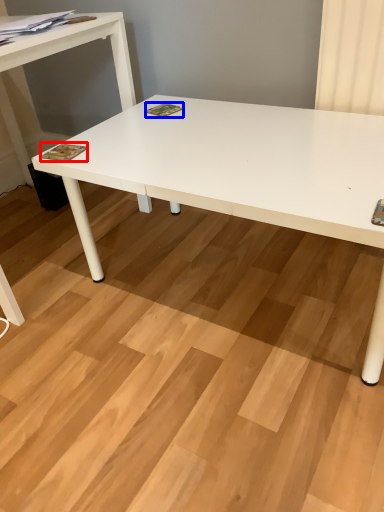
Question: Which point is closer to the camera, magazine (highlighted by a red box) or magazine (highlighted by a blue box)?

Choices:
 (A) magazine
 (B) magazine

Answer: (A)